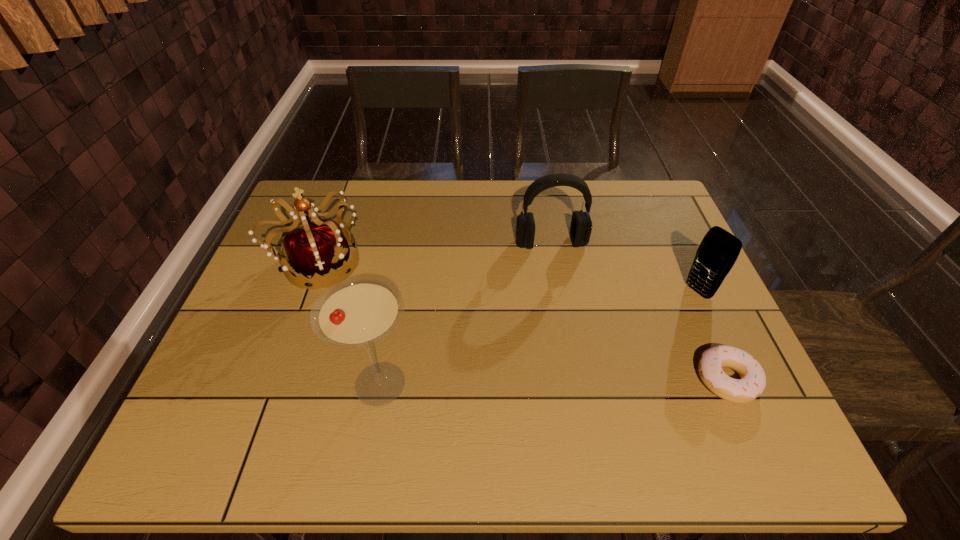
Identify the location of cellular telephone present at the right edge. (718, 251).

Find the location of a particular element. This screenshot has height=540, width=960. object positioned at the near right corner is located at coordinates (752, 382).

Image resolution: width=960 pixels, height=540 pixels. In order to click on free region at the far edge of the desktop in this screenshot , I will do `click(380, 194)`.

This screenshot has height=540, width=960. Identify the location of blank area at the near edge. (432, 407).

Locate an element on the screen. free region at the left edge of the desktop is located at coordinates (299, 227).

At what (x,y) coordinates should I click in order to perform the action: click on vacant space at the right edge of the desktop. Please return your answer as a coordinate pair (x, y). The image size is (960, 540). Looking at the image, I should click on (663, 241).

At what (x,y) coordinates should I click in order to perform the action: click on vacant area at the far right corner of the desktop. Please return your answer as a coordinate pair (x, y). Looking at the image, I should click on (662, 219).

You are a GUI agent. You are given a task and a screenshot of the screen. Output one action in this format:
    pyautogui.click(x=<x>, y=<y>)
    Task: Click on the free space between the leftmost object and the third object from right to left
    This screenshot has height=540, width=960.
    Given the screenshot: What is the action you would take?
    pyautogui.click(x=435, y=253)

The image size is (960, 540). I want to click on free point between the cellular telephone and the third object from left to right, so click(624, 267).

At what (x,y) coordinates should I click in order to perform the action: click on vacant area between the shortest object and the martini. Please return your answer as a coordinate pair (x, y). This screenshot has height=540, width=960. Looking at the image, I should click on (554, 382).